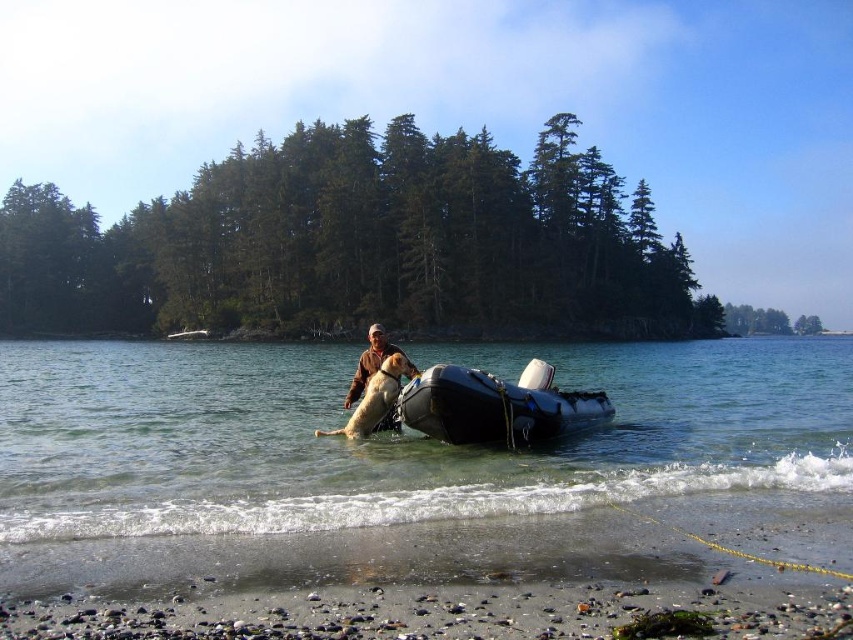
You are a photographer trying to capture the man in his brown leather jacket at center and his dog in the black rubber boat at center. Since you want to frame both subjects clearly, which object should you position closer to the left side of your camera frame?

The brown leather jacket at center should be positioned closer to the left side of the camera frame because the black rubber boat at center is to the right of it.

You are a photographer trying to capture the man in his brown leather jacket at center and the black rubber boat at center. Based on their positions, which object is closer to the camera?

The brown leather jacket at center is closer to the camera because it is above the black rubber boat at center, indicating a higher position in the visual plane.

You are planning to store the clear rubber boat at center and the brown leather jacket at center in your garage. The garage has a storage rack with a width of 1.2 meters. Can both items fit side by side on the rack without overlapping?

The clear rubber boat at center might be wider than brown leather jacket at center. Since the total width of both items could exceed 1.2 meters, it is uncertain if they can fit side by side without overlapping. Measure their combined width to confirm.